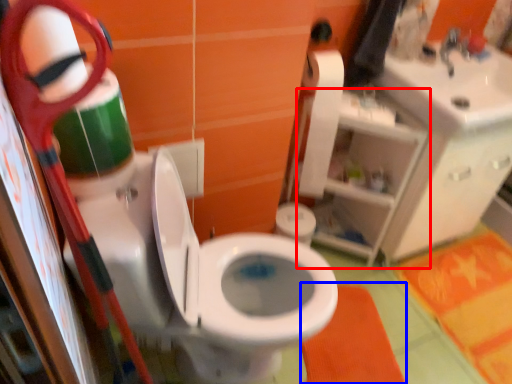
Question: Among these objects, which one is nearest to the camera, shelf (highlighted by a red box) or bath mat (highlighted by a blue box)?

Choices:
 (A) shelf
 (B) bath mat

Answer: (A)